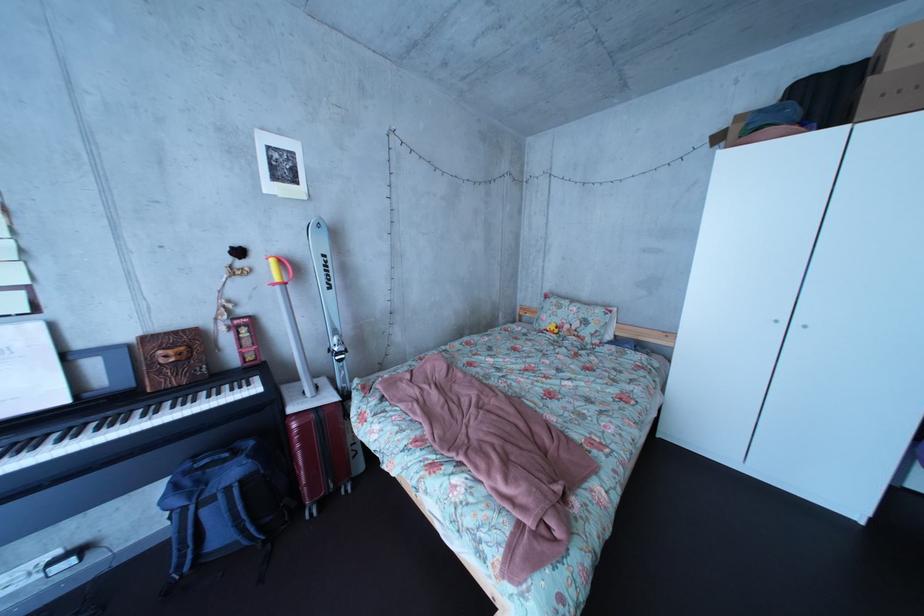
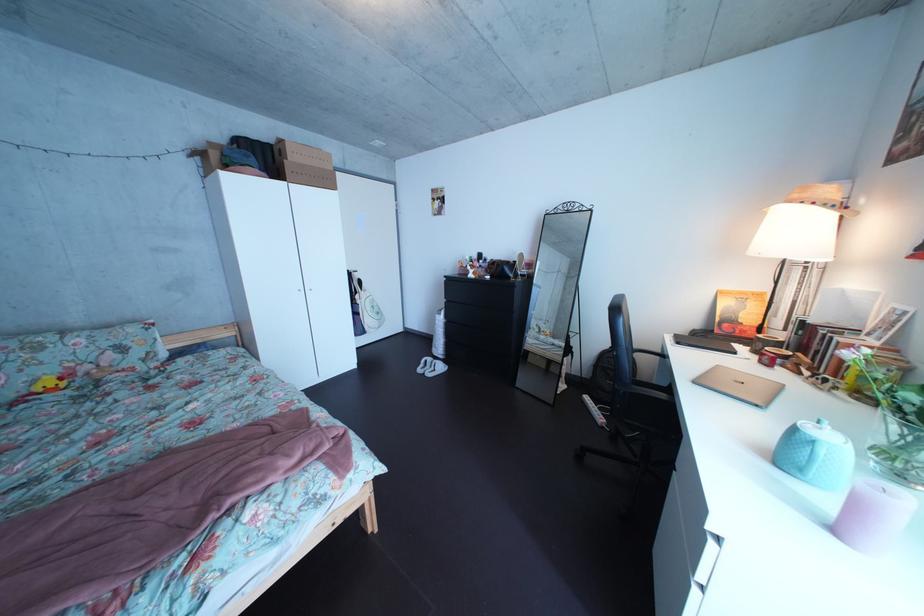
First-person continuous shooting, in which direction is the camera rotating?

The camera's rotation is toward right-down.